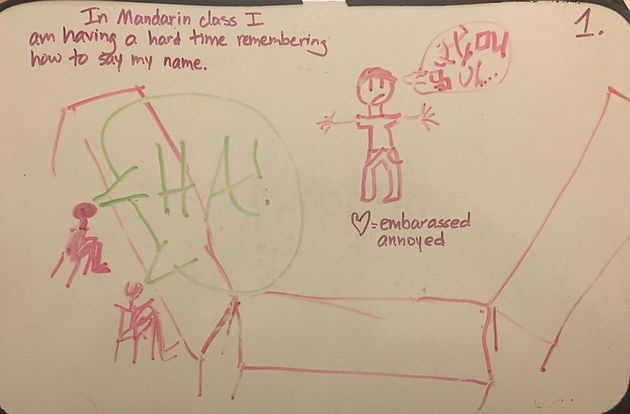
The width and height of the screenshot is (630, 414). Identify the location of table. (398, 372).